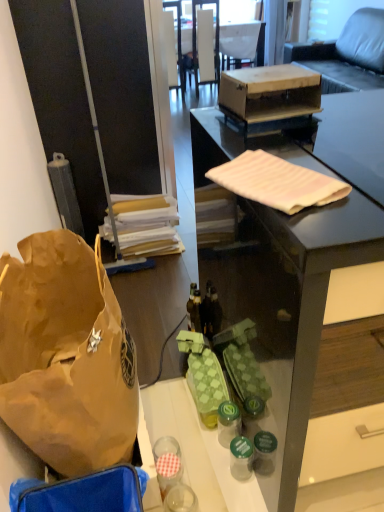
Where is `spots to the right of wooden box at center`? This screenshot has width=384, height=512. spots to the right of wooden box at center is located at coordinates (352, 109).